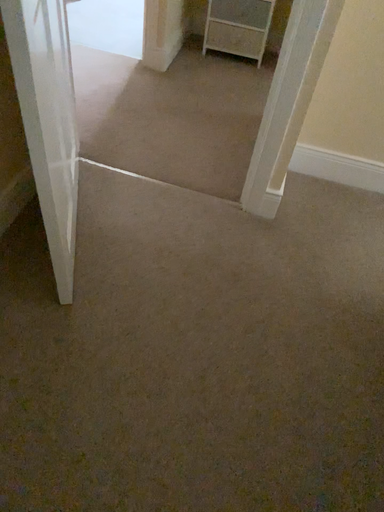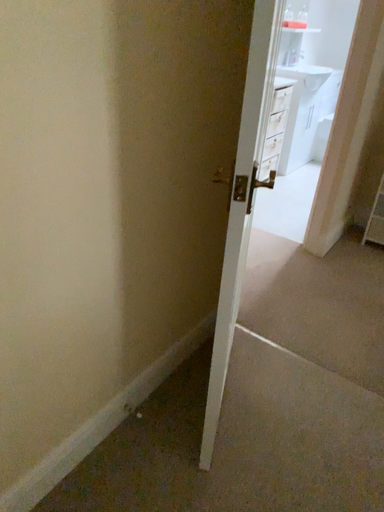
Question: How did the camera likely rotate when shooting the video?

Choices:
 (A) rotated upward
 (B) rotated downward

Answer: (A)